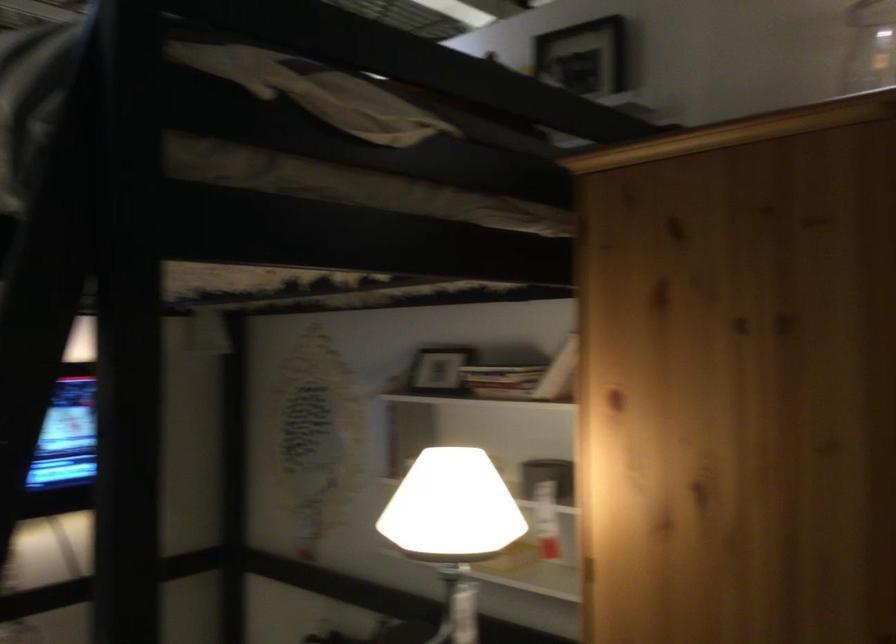
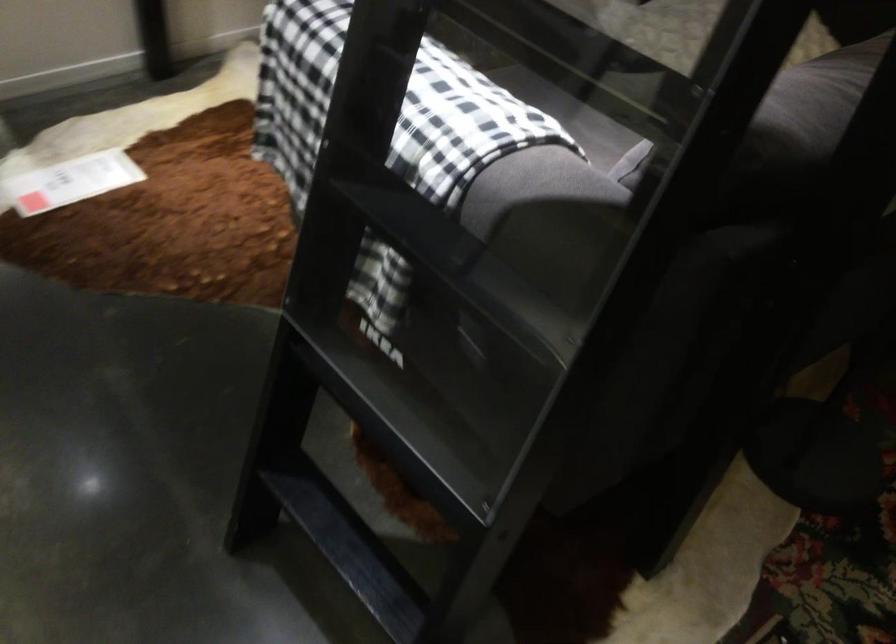
Question: Based on the continuous images, in which direction is the camera rotating? Reply with the corresponding letter.

Choices:
 (A) Left
 (B) Right
 (C) Up
 (D) Down

Answer: (D)